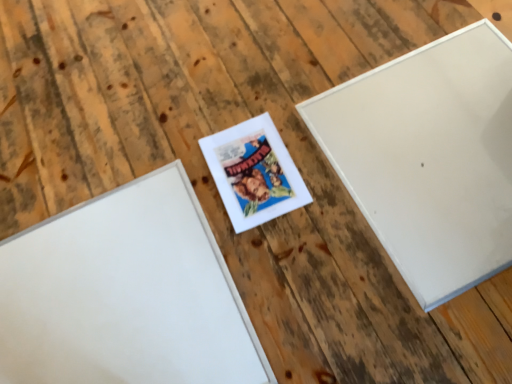
This screenshot has height=384, width=512. Find the location of `free point above white matte picture frame at center, positioned as the 3th picture frame in right-to-left order (from a real-world perspective)`. free point above white matte picture frame at center, positioned as the 3th picture frame in right-to-left order (from a real-world perspective) is located at coordinates (113, 297).